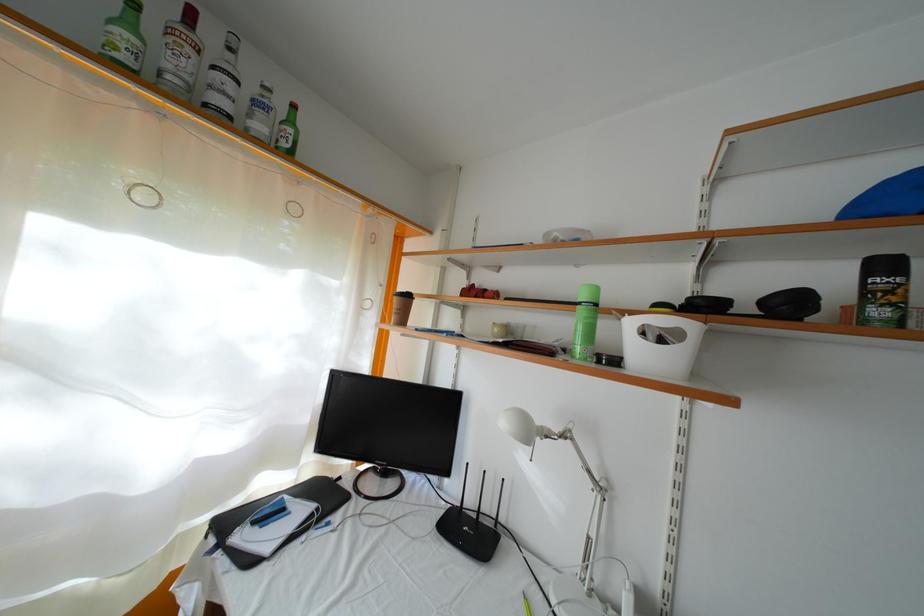
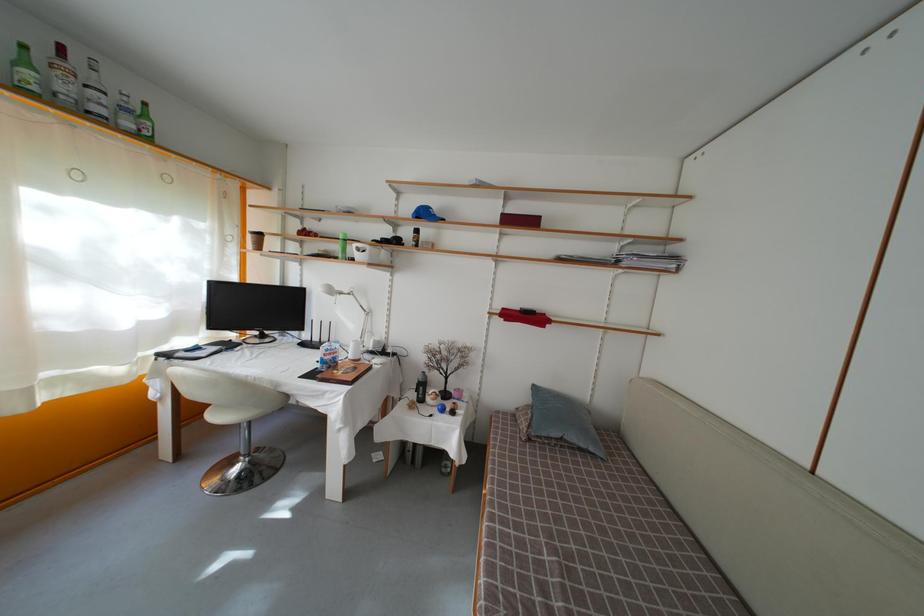
Find the pixel in the second image that matches point (211, 111) in the first image.

(94, 119)